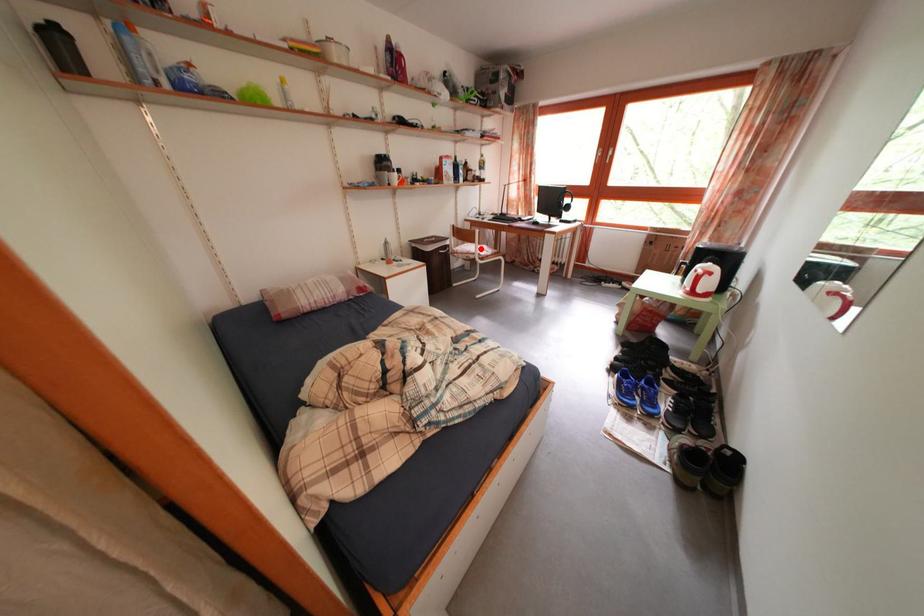
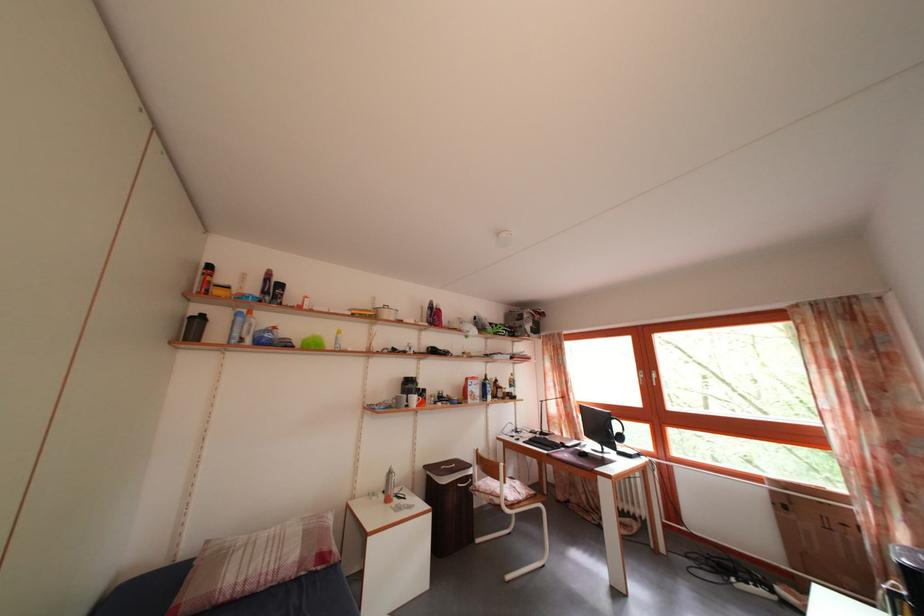
Find the pixel in the second image that matches the highlighted location in the first image.

(505, 485)